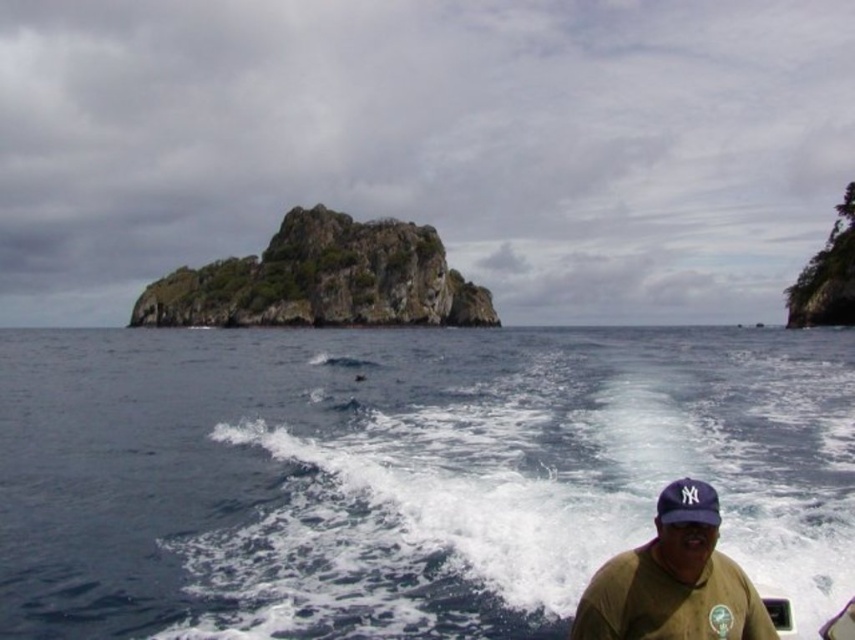
Based on the scene description, what is located at the coordinates point [402,474]?

The blue water at center is located at point [402,474].

You are navigating a boat in the seascape scene. You need to reach the blue water at center marked by point (402,474). The boat is currently at the position of the person wearing a dark baseball cap with a white logo and light brown shirt. Can you safely navigate the boat directly to the blue water at center without passing through the wake trailing behind the boat?

The blue water at center is represented by point (402,474). Since the boat is currently at the position of the person and the wake is trailing behind them, navigating directly to the blue water at center would require moving forward, away from the wake. Therefore, it is safe to navigate directly to the blue water at center without passing through the wake.